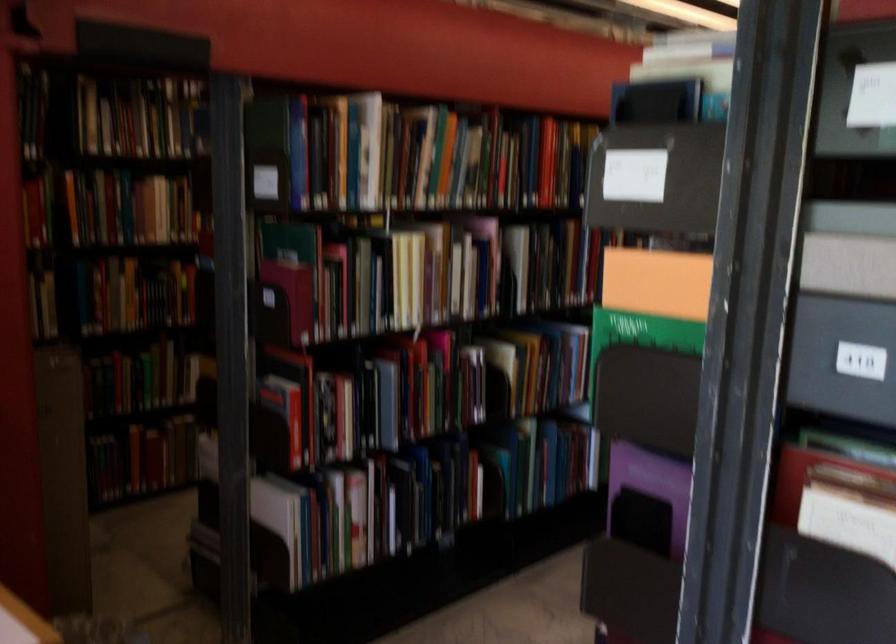
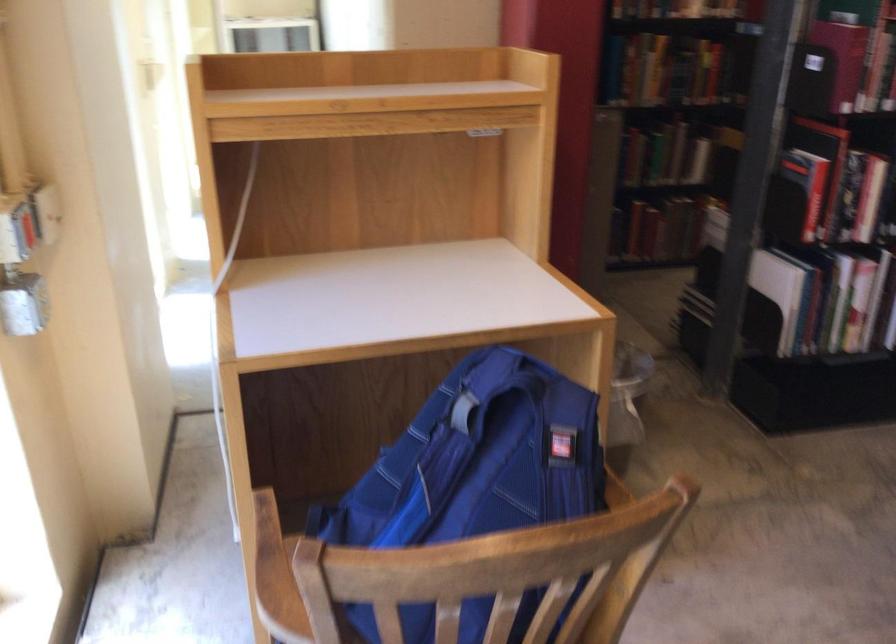
Where in the second image is the point corresponding to the point at 277,428 from the first image?

(806, 185)